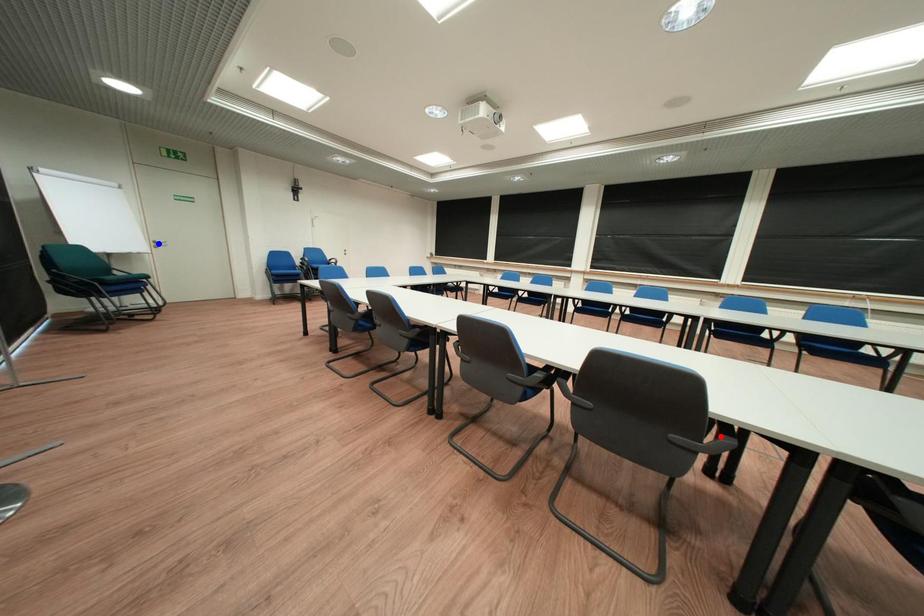
Question: Which of the two points in the image is closer to the camera?

Choices:
 (A) Blue point is closer.
 (B) Red point is closer.

Answer: (B)